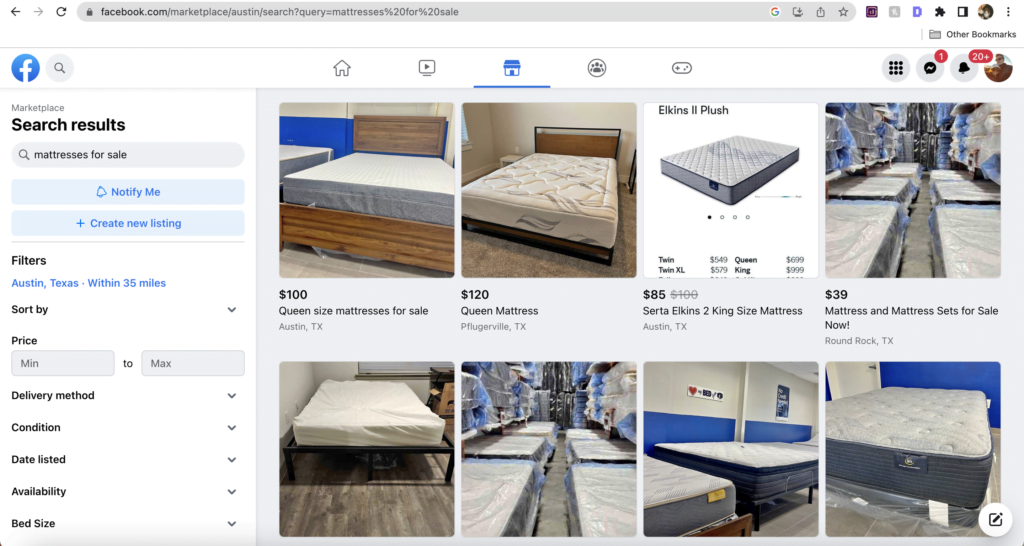
What are the coordinates of `bed frames` in the screenshot? It's located at (401, 136), (582, 143), (430, 445), (758, 516), (731, 530).